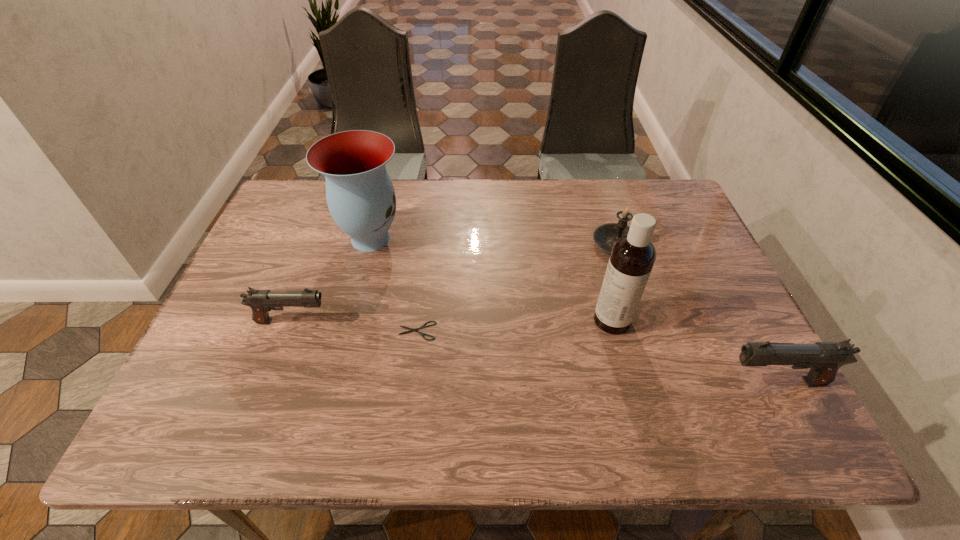
The height and width of the screenshot is (540, 960). I want to click on free spot between the vase and the left gun, so click(331, 280).

The width and height of the screenshot is (960, 540). I want to click on vacant space that's between the fourth object from right to left and the rightmost object, so click(x=596, y=356).

Where is `free spot between the shortest object and the second shortest object`? The height and width of the screenshot is (540, 960). free spot between the shortest object and the second shortest object is located at coordinates (354, 326).

Identify the location of empty location between the candle and the fifth tallest object. The image size is (960, 540). (454, 283).

Where is `empty space that is in between the shears and the candle`? The height and width of the screenshot is (540, 960). empty space that is in between the shears and the candle is located at coordinates (517, 287).

Where is `empty location between the nearest object and the vase`? empty location between the nearest object and the vase is located at coordinates (573, 310).

Locate an element on the screen. The width and height of the screenshot is (960, 540). free spot between the dishwasher detergent and the vase is located at coordinates (492, 279).

Find the location of `unoccupied position between the rightmost object and the candle`. unoccupied position between the rightmost object and the candle is located at coordinates [696, 313].

The width and height of the screenshot is (960, 540). Find the location of `object that is the closest to the shorter gun`. object that is the closest to the shorter gun is located at coordinates (423, 326).

Where is `the third closest object to the right gun`? This screenshot has height=540, width=960. the third closest object to the right gun is located at coordinates (423, 326).